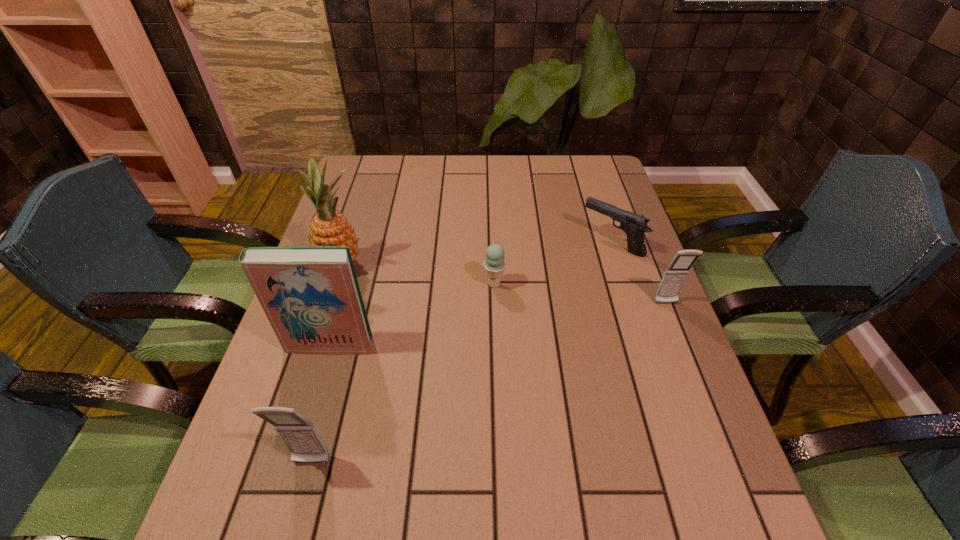
This screenshot has width=960, height=540. Find the location of `cellular telephone that is at the right edge`. cellular telephone that is at the right edge is located at coordinates (675, 275).

I want to click on gun that is at the right edge, so click(634, 225).

Identify the location of object that is at the near left corner. This screenshot has height=540, width=960. (300, 435).

Identify the location of free space at the far edge of the desktop. This screenshot has width=960, height=540. (561, 186).

In order to click on free region at the left edge in this screenshot , I will do `click(355, 200)`.

This screenshot has height=540, width=960. What are the coordinates of `free point at the right edge` in the screenshot? It's located at (599, 253).

Find the location of a particular element. This screenshot has height=540, width=960. free space at the far left corner is located at coordinates (362, 159).

The width and height of the screenshot is (960, 540). In order to click on free space at the near left corner of the desktop in this screenshot , I will do `click(244, 437)`.

I want to click on vacant region at the far right corner of the desktop, so click(x=582, y=193).

What are the coordinates of `free space between the gun and the ice cream` in the screenshot? It's located at (553, 264).